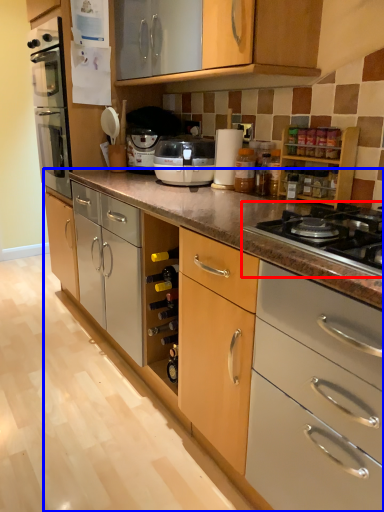
Question: Which object appears closest to the camera in this image, gas stove (highlighted by a red box) or cabinetry (highlighted by a blue box)?

Choices:
 (A) gas stove
 (B) cabinetry

Answer: (A)